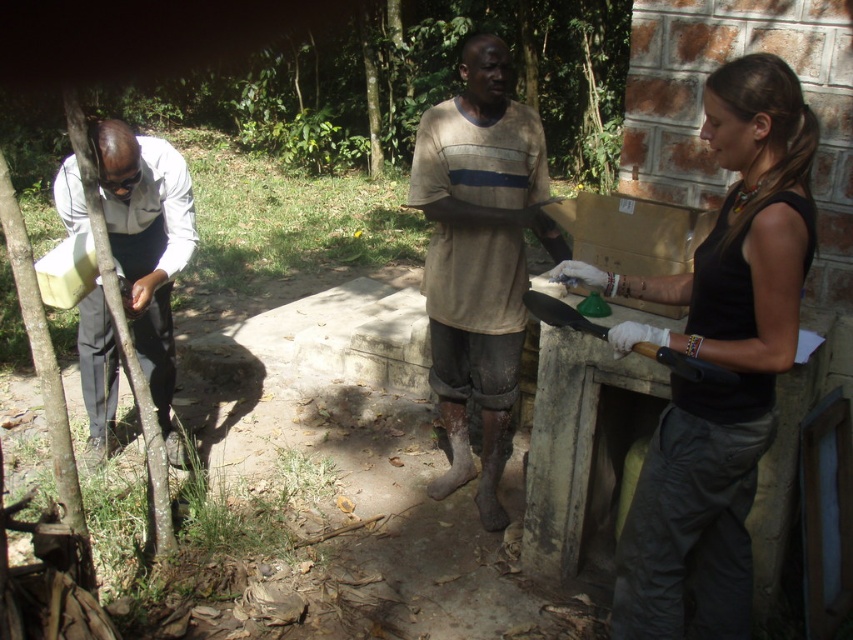
Is black matte tank top at right shorter than matte white shirt at left?

In fact, black matte tank top at right may be taller than matte white shirt at left.

Is black matte tank top at right to the left of matte white shirt at left from the viewer's perspective?

No, black matte tank top at right is not to the left of matte white shirt at left.

Locate an element on the screen. The image size is (853, 640). black matte tank top at right is located at coordinates (718, 364).

Where is `black matte tank top at right`? This screenshot has width=853, height=640. black matte tank top at right is located at coordinates (718, 364).

Who is higher up, black matte tank top at right or brown cotton shirt at center?

brown cotton shirt at center is above.

Which is behind, point (755, 157) or point (547, 230)?

The point (547, 230) is behind.

Where is `black matte tank top at right`? black matte tank top at right is located at coordinates (718, 364).

Who is higher up, brown cotton shirt at center or matte white shirt at left?

brown cotton shirt at center is higher up.

Which is in front, point (492, 442) or point (155, 156)?

Point (155, 156) is more forward.

Does point (456, 342) come farther from viewer compared to point (165, 289)?

No, it is in front of (165, 289).

Locate an element on the screen. The width and height of the screenshot is (853, 640). brown cotton shirt at center is located at coordinates (479, 257).